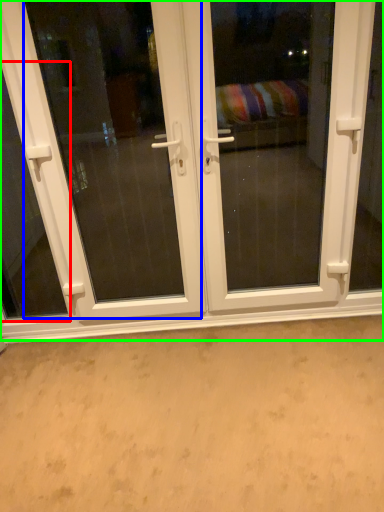
Question: Considering the real-world distances, which object is farthest from window (highlighted by a red box)? screen door (highlighted by a blue box) or door (highlighted by a green box)?

Choices:
 (A) screen door
 (B) door

Answer: (A)